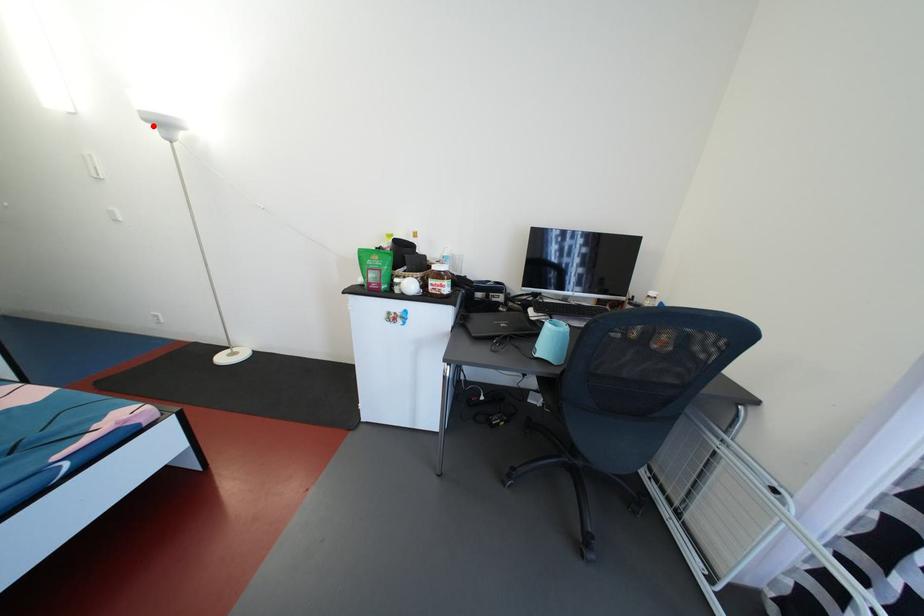
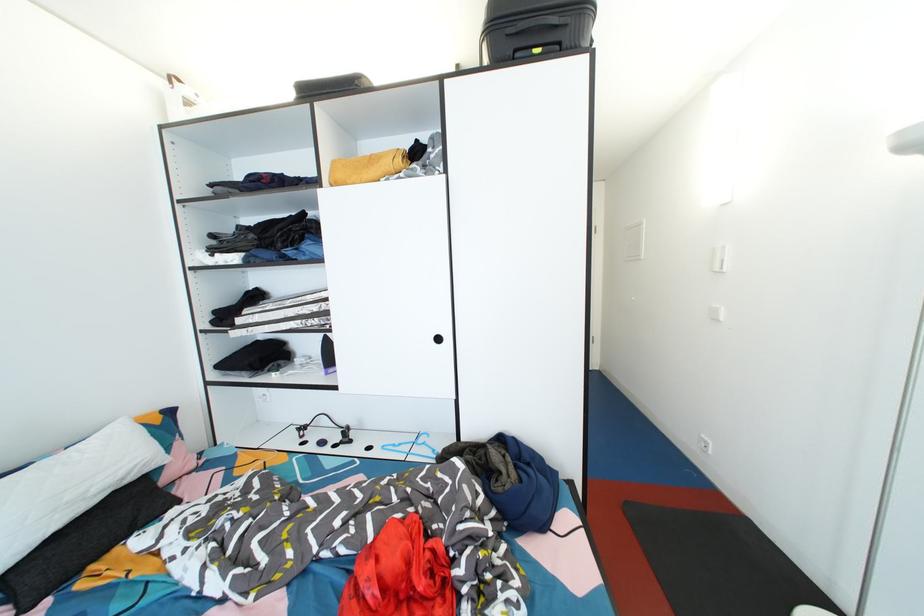
The point at the highlighted location is marked in the first image. Where is the corresponding point in the second image?

(913, 152)